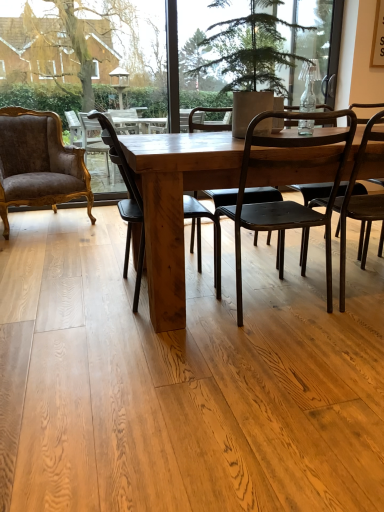
What are the coordinates of `unoccupied area in front of velvet brown armchair at left, acting as the 1th chair starting from the left` in the screenshot? It's located at [x=42, y=248].